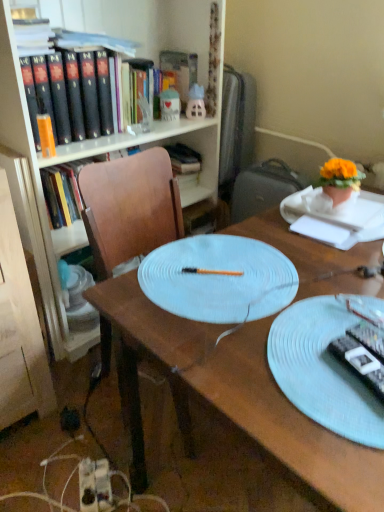
Where is `vacant region to the right of orange fabric flower pot at upper right`? vacant region to the right of orange fabric flower pot at upper right is located at coordinates (369, 205).